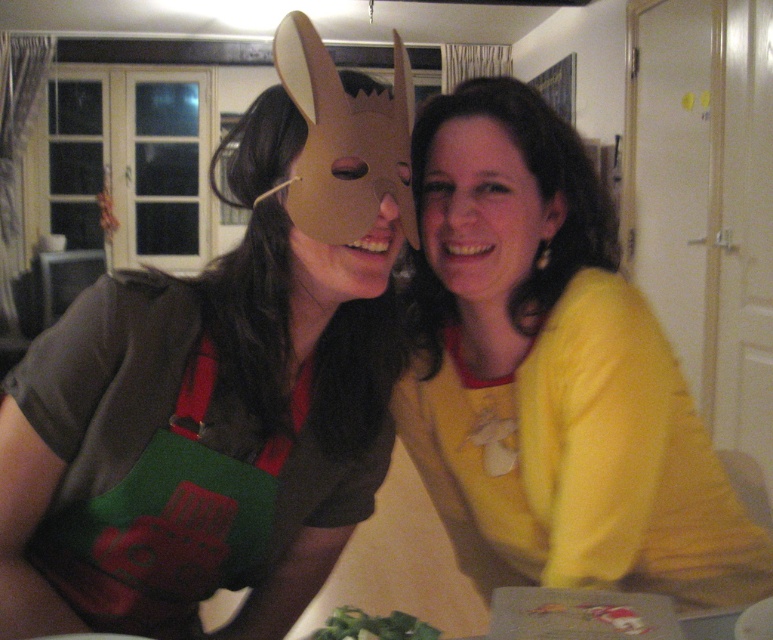
Question: Can you confirm if yellow matte sweater at center is thinner than matte cardboard mask at center?

Choices:
 (A) yes
 (B) no

Answer: (B)

Question: Estimate the real-world distances between objects in this image. Which object is farther from the matte brown mask at upper left?

Choices:
 (A) matte cardboard mask at center
 (B) green leafy vegetable at lower center
 (C) yellow matte sweater at center

Answer: (B)

Question: Can you confirm if matte yellow shirt at center is positioned to the right of matte cardboard mask at center?

Choices:
 (A) no
 (B) yes

Answer: (B)

Question: Which is farther from the yellow matte sweater at center?

Choices:
 (A) green leafy vegetable at lower center
 (B) matte yellow shirt at center

Answer: (A)

Question: Considering the relative positions of matte yellow shirt at center and matte cardboard mask at center in the image provided, where is matte yellow shirt at center located with respect to matte cardboard mask at center?

Choices:
 (A) right
 (B) left

Answer: (A)

Question: Which object is positioned farthest from the green leafy vegetable at lower center?

Choices:
 (A) yellow matte sweater at center
 (B) matte brown mask at upper left
 (C) matte cardboard mask at center

Answer: (C)